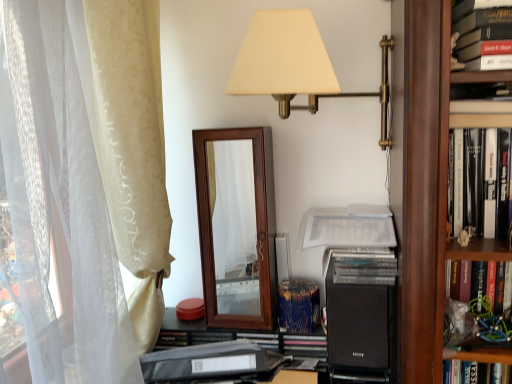
Question: From a real-world perspective, is hardcover book at right, which is counted as the 1th book, starting from the bottom, positioned above or below black matte speaker at center?

Choices:
 (A) below
 (B) above

Answer: (B)

Question: From the image's perspective, is hardcover book at right, which is counted as the 1th book, starting from the bottom, above or below black matte speaker at center?

Choices:
 (A) below
 (B) above

Answer: (B)

Question: Estimate the real-world distances between objects in this image. Which object is closer to the matte gold lamp at upper center?

Choices:
 (A) black matte speaker at center
 (B) beige satin curtain at left
 (C) hardcover book at right, which is the first book from back to front
 (D) white paper at center
 (E) hardcover book at upper right, the 2th book viewed from the back

Answer: (D)

Question: Considering the real-world distances, which object is farthest from the black matte speaker at center?

Choices:
 (A) matte gold lamp at upper center
 (B) hardcover book at right, the second book when ordered from top to bottom
 (C) hardcover book at upper right, marked as the first book in a front-to-back arrangement
 (D) black plastic folder at lower center
 (E) wooden mirror at center

Answer: (C)